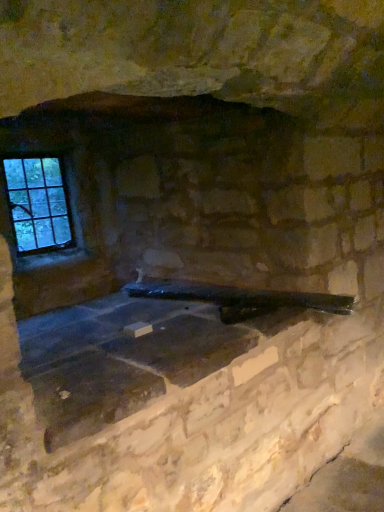
What do you see at coordinates (38, 204) in the screenshot?
I see `clear glass window at upper left` at bounding box center [38, 204].

You are a GUI agent. You are given a task and a screenshot of the screen. Output one action in this format:
    pyautogui.click(x=<x>, y=<y>)
    Task: Click on the clear glass window at upper left
    
    Given the screenshot: What is the action you would take?
    pyautogui.click(x=38, y=204)

The height and width of the screenshot is (512, 384). What are the coordinates of `clear glass window at upper left` in the screenshot? It's located at (38, 204).